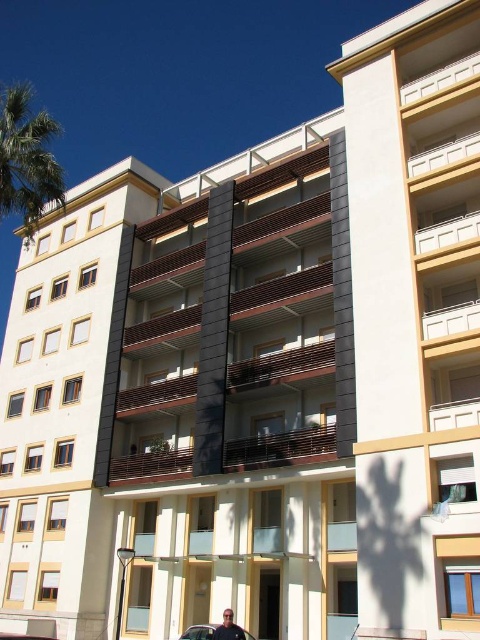
Consider the image. You are standing in front of the residential building and notice the green leafy palm tree at upper left and the shiny black sedan at lower center. Which object appears larger in the image?

The green leafy palm tree at upper left appears larger than the shiny black sedan at lower center according to the description.

You are standing on the ground floor of the building and looking up at the brown wooden balcony at center and the green leafy palm tree at upper left. Which one appears taller from your perspective?

The green leafy palm tree at upper left appears taller than the brown wooden balcony at center from your perspective because the brown wooden balcony at center is shorter than the green leafy palm tree at upper left.